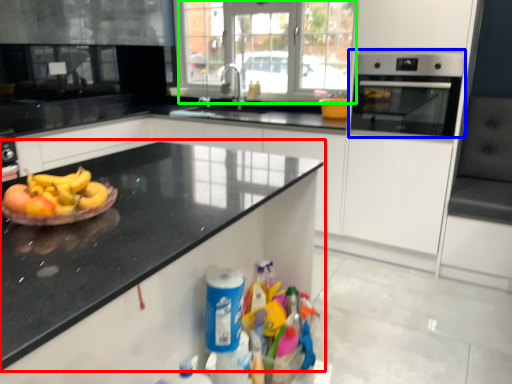
Question: Which object is positioned closest to countertop (highlighted by a red box)? Select from home appliance (highlighted by a blue box) and glass door (highlighted by a green box).

Choices:
 (A) home appliance
 (B) glass door

Answer: (A)